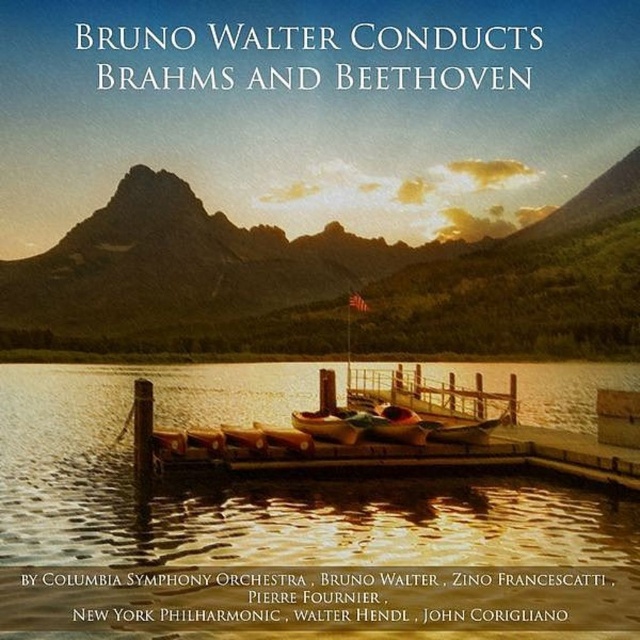
You are standing at the lakeside and want to take a photo of both the glistening water at dock center and the green textured mountain at center. Which object will appear smaller in your photo?

The glistening water at dock center will appear smaller in your photo because it has a smaller size compared to the green textured mountain at center.

You are standing on the wooden dock and want to take a photo that includes both the glistening water at dock center and the green textured mountain at center. Which object should you position closer to the edge of the frame to ensure both are visible?

You should position the glistening water at dock center closer to the edge of the frame since it is shorter than the green textured mountain at center, allowing both to fit within the photo.